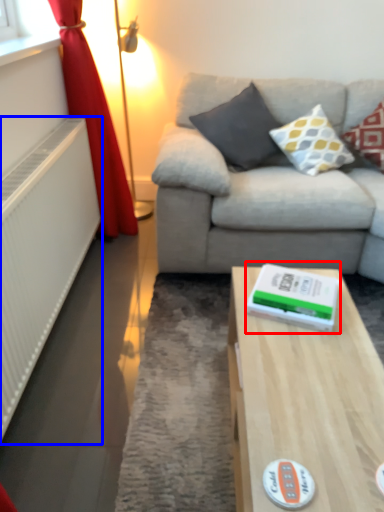
Question: Which object is further to the camera taking this photo, paperback book (highlighted by a red box) or radiator (highlighted by a blue box)?

Choices:
 (A) paperback book
 (B) radiator

Answer: (A)